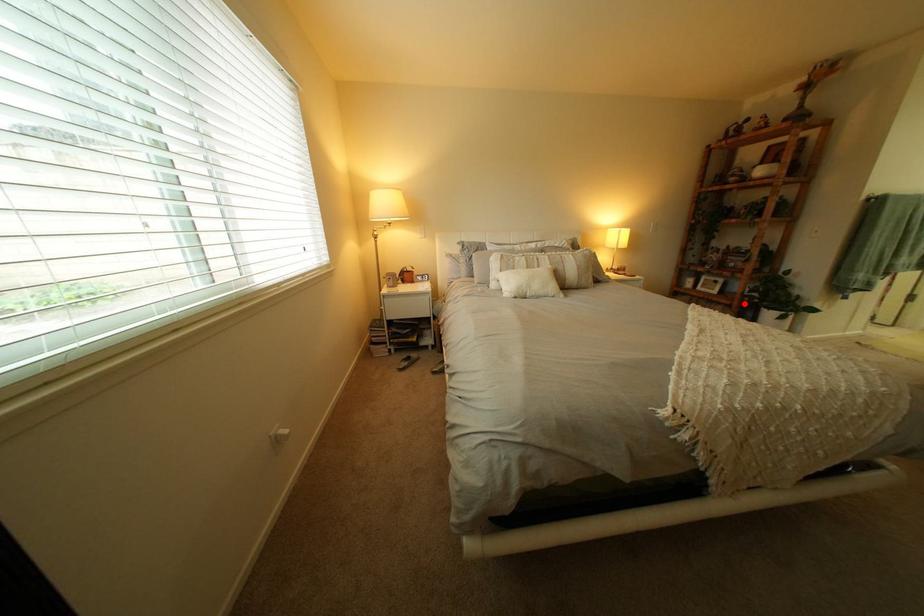
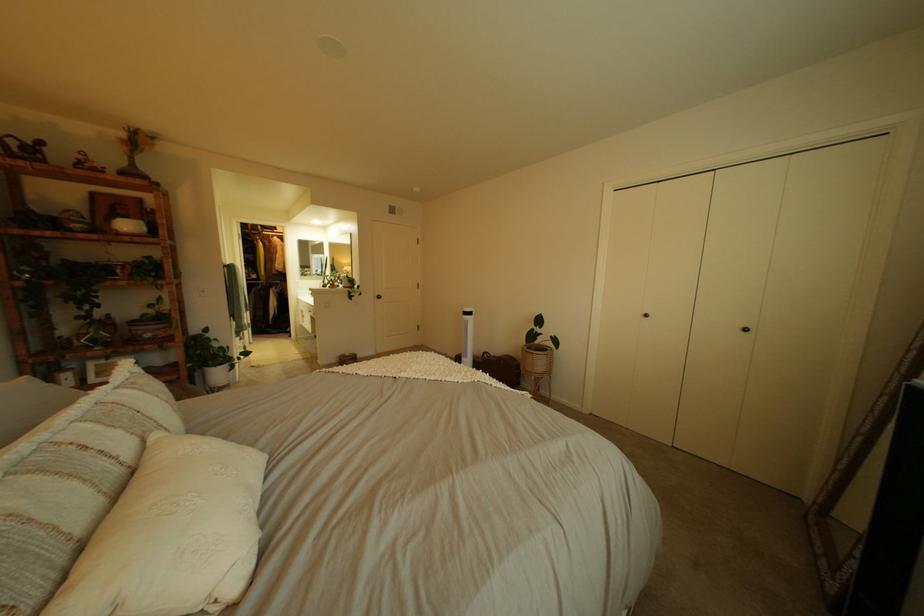
Question: A red point is marked in image1. In image2, is the corresponding 3D point closer to the camera or farther? Reply with the corresponding letter.

Choices:
 (A) The corresponding 3D point is closer.
 (B) The corresponding 3D point is farther.

Answer: (A)